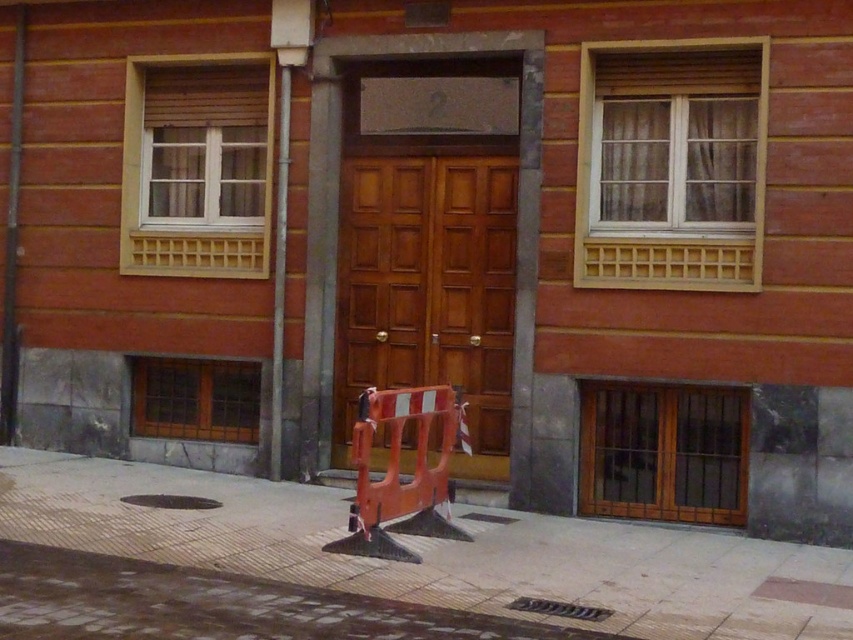
You are a delivery person with a cart that is 5 meters wide. You need to move through the space between the smooth concrete pavement at center and the wooden at center. Can your cart fit through the space between them?

The space between the smooth concrete pavement at center and the wooden at center is 4.81 meters. Since your cart is 5 meters wide, it cannot fit through the space between them.

You are a delivery person trying to determine if your 1.2 meter wide cart can fit through the space between the wooden at center and the metallic gray pole at left. Based on the image, can your cart pass through?

The wooden at center might be wider than metallic gray pole at left, so the space between them may be insufficient for a 1.2 meter wide cart. It is uncertain and requires further measurement.